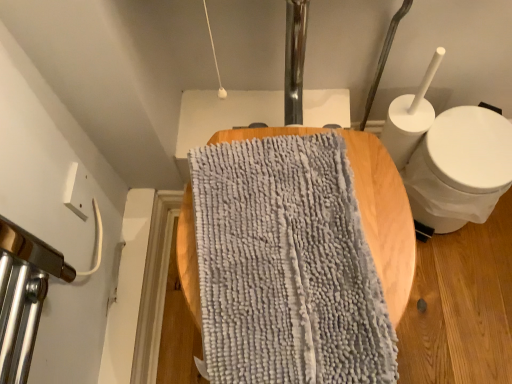
The width and height of the screenshot is (512, 384). What are the coordinates of `blank space situated above white matte toilet at right (from a real-world perspective)` in the screenshot? It's located at (474, 153).